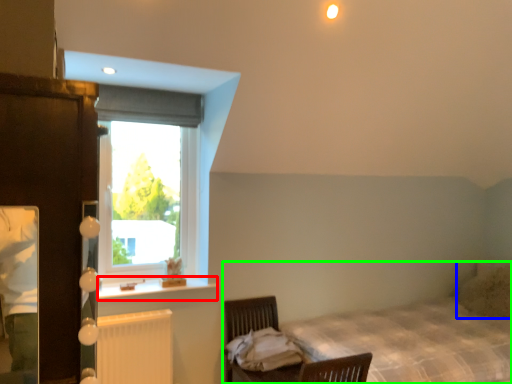
Question: Which object is positioned farthest from window sill (highlighted by a red box)? Select from pillow (highlighted by a blue box) and bed (highlighted by a green box).

Choices:
 (A) pillow
 (B) bed

Answer: (A)